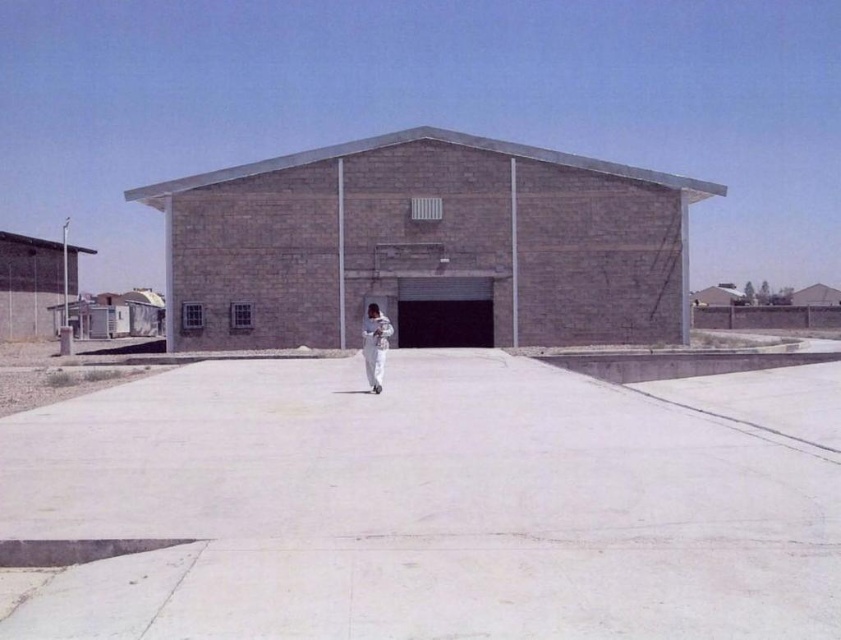
You are standing at the entrance of the building and want to walk to the white concrete pavement at center. Which direction should you go?

The white concrete pavement at center is located at point (427, 504), so you should walk forward towards the center of the parking lot.

You are standing in front of the building and want to walk to the entrance. Which object, the white concrete pavement at center or the white matte jumpsuit at center, is between you and the entrance?

The white concrete pavement at center is between you and the entrance because it is closer to the viewer than the white matte jumpsuit at center.

You are standing in front of the building and want to reach the entrance. If you walk straight ahead, how far will you have to walk to reach the point marked at coordinates point (479, 516)?

The point marked at coordinates point (479, 516) is 6.75 meters away from the viewer, so you would need to walk 6.75 meters straight ahead to reach it.